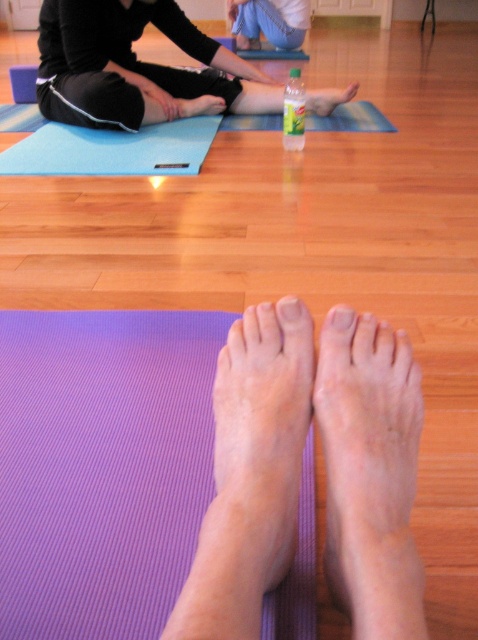
Does blue denim jeans at upper center have a greater width compared to pale skin toe at center?

Yes, blue denim jeans at upper center is wider than pale skin toe at center.

Which is more to the right, blue denim jeans at upper center or pale skin toe at center?

blue denim jeans at upper center is more to the right.

What are the coordinates of `blue denim jeans at upper center` in the screenshot? It's located at [269, 20].

Between black matte leggings at upper center and matte plastic toe at center, which one appears on the left side from the viewer's perspective?

black matte leggings at upper center is more to the left.

Find the location of a particular element. This screenshot has height=640, width=478. black matte leggings at upper center is located at coordinates (133, 67).

Locate an element on the screen. This screenshot has height=640, width=478. dry skin feet at lower center is located at coordinates (370, 472).

Does dry skin feet at lower center appear on the right side of pale skin toe at center?

Correct, you'll find dry skin feet at lower center to the right of pale skin toe at center.

Does point (411, 557) come in front of point (292, 301)?

Yes, it is in front of point (292, 301).

Locate an element on the screen. The image size is (478, 640). dry skin feet at lower center is located at coordinates (370, 472).